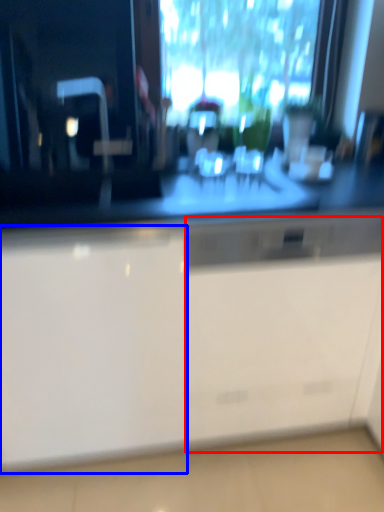
Question: Among these objects, which one is nearest to the camera, file cabinet (highlighted by a red box) or cabinetry (highlighted by a blue box)?

Choices:
 (A) file cabinet
 (B) cabinetry

Answer: (B)